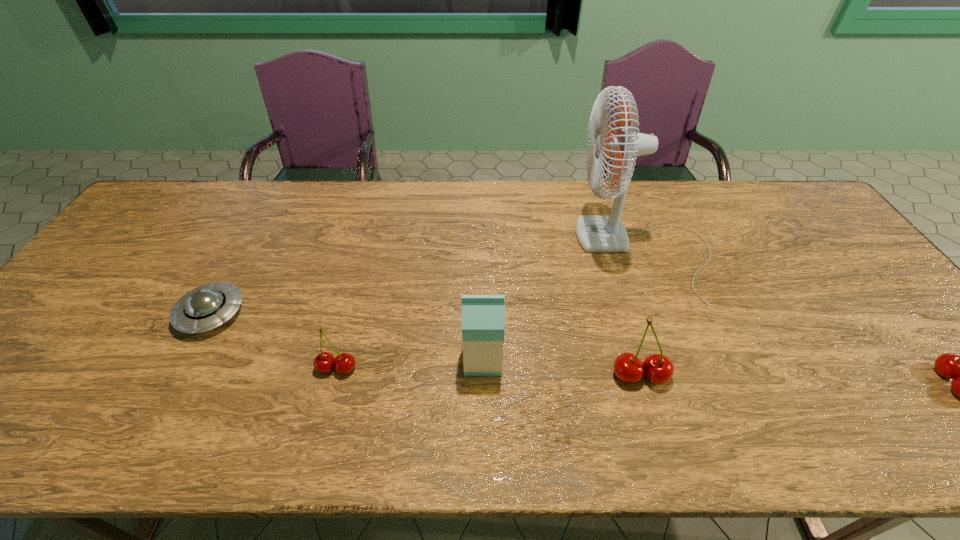
You are a GUI agent. You are given a task and a screenshot of the screen. Output one action in this format:
    pyautogui.click(x=<x>, y=<y>)
    Task: Click on the blank space located 0.150m on the front-facing side of the tallest object
    This screenshot has height=540, width=960.
    Given the screenshot: What is the action you would take?
    pyautogui.click(x=528, y=252)

At what (x,y) coordinates should I click in order to perform the action: click on vacant region located on the left of the shortest object. Please return your answer as a coordinate pair (x, y). The width and height of the screenshot is (960, 540). Looking at the image, I should click on (129, 314).

Locate an element on the screen. This screenshot has width=960, height=540. free space located on the right of the milk carton is located at coordinates (662, 360).

Identify the location of object that is at the far edge. (596, 233).

Find the location of `milk carton present at the near edge`. milk carton present at the near edge is located at coordinates (483, 316).

What are the coordinates of `free region at the far edge` in the screenshot? It's located at (747, 212).

Locate an element on the screen. vacant space at the near edge of the desktop is located at coordinates point(712,399).

Find the location of a particular element. This screenshot has width=960, height=540. vacant point at the left edge is located at coordinates (47, 352).

The image size is (960, 540). Identify the location of vacant space at the near left corner of the desktop. (60, 374).

Locate an element on the screen. Image resolution: width=960 pixels, height=540 pixels. free area in between the leftmost object and the tallest object is located at coordinates (428, 283).